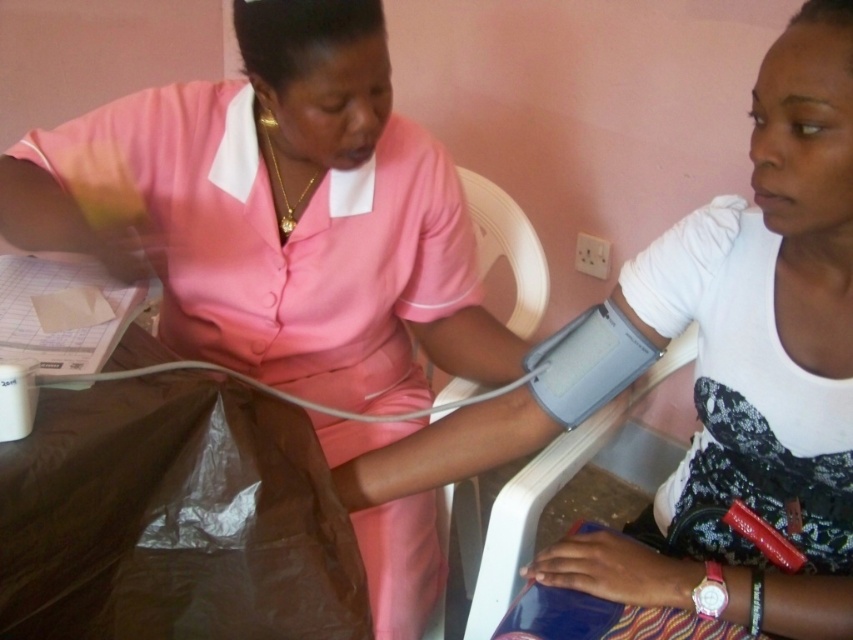
Based on the photo, you are a patient in the medical setting described. You need to identify which item is bigger between the pink fabric nurse at center and the matte pink uniform at center. Which one is larger?

The pink fabric nurse at center is larger than the matte pink uniform at center according to the description.

Please provide the coordinates of the pink fabric nurse at center in the image. The coordinates should be in the format of a point like point (x=277, y=212).

The coordinates of the pink fabric nurse at center are point (x=277, y=212).

You are a nurse who needs to hand a patient a form located on the table. The form is between the pink fabric nurse at center and the matte pink uniform at center. Can you reach it without moving either of them?

The pink fabric nurse at center and the matte pink uniform at center are 27.50 centimeters apart. Since the form is between them, you can reach it as the distance allows access without needing to move either object.